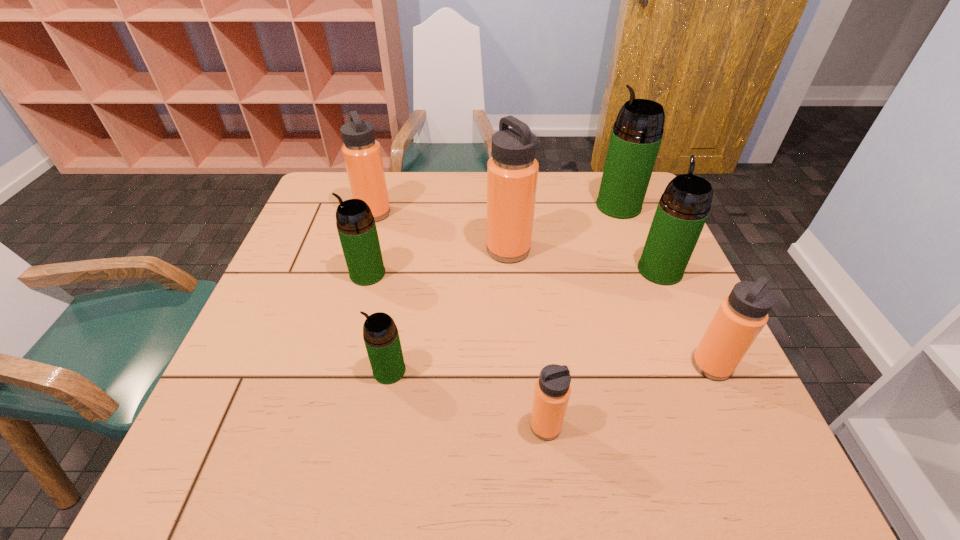
You are a GUI agent. You are given a task and a screenshot of the screen. Output one action in this format:
    pyautogui.click(x=<x>, y=<y>)
    Task: Click on the vacant area at the far edge
    The width and height of the screenshot is (960, 540).
    Given the screenshot: What is the action you would take?
    pyautogui.click(x=486, y=205)

Where is `free space at the near edge`? The width and height of the screenshot is (960, 540). free space at the near edge is located at coordinates (407, 464).

In the image, there is a desktop. At what (x,y) coordinates should I click in order to perform the action: click on free region at the left edge. Please return your answer as a coordinate pair (x, y). This screenshot has height=540, width=960. Looking at the image, I should click on (222, 416).

The height and width of the screenshot is (540, 960). Find the location of `vacant space at the right edge`. vacant space at the right edge is located at coordinates (691, 330).

This screenshot has height=540, width=960. In order to click on free space between the biggest green thermos bottle and the nearest orange thermos bottle in this screenshot , I will do `click(582, 316)`.

I want to click on unoccupied area between the biggest green thermos bottle and the rightmost orange thermos bottle, so click(665, 286).

Locate an element on the screen. This screenshot has height=540, width=960. vacant space that's between the farthest green thermos bottle and the second nearest orange thermos bottle is located at coordinates (665, 286).

Find the location of `free space between the leftmost orange thermos bottle and the second farthest orange thermos bottle`. free space between the leftmost orange thermos bottle and the second farthest orange thermos bottle is located at coordinates (441, 231).

Image resolution: width=960 pixels, height=540 pixels. Find the location of `free space between the nearest green thermos bottle and the farthest green thermos bottle`. free space between the nearest green thermos bottle and the farthest green thermos bottle is located at coordinates (504, 288).

What are the coordinates of `vacant space that is in between the nearest orange thermos bottle and the farthest orange thermos bottle` in the screenshot? It's located at (460, 320).